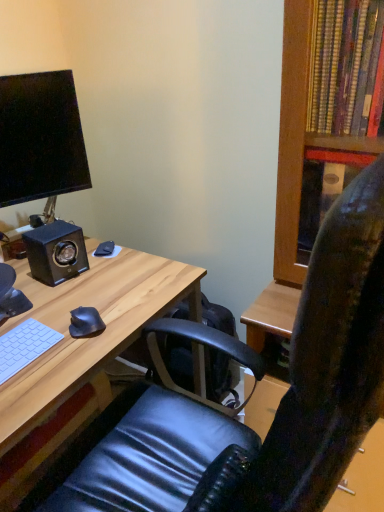
Find the location of `free location to the right of black matte mouse at lower left, which is counted as the 2th mouse, starting from the front`. free location to the right of black matte mouse at lower left, which is counted as the 2th mouse, starting from the front is located at coordinates (139, 259).